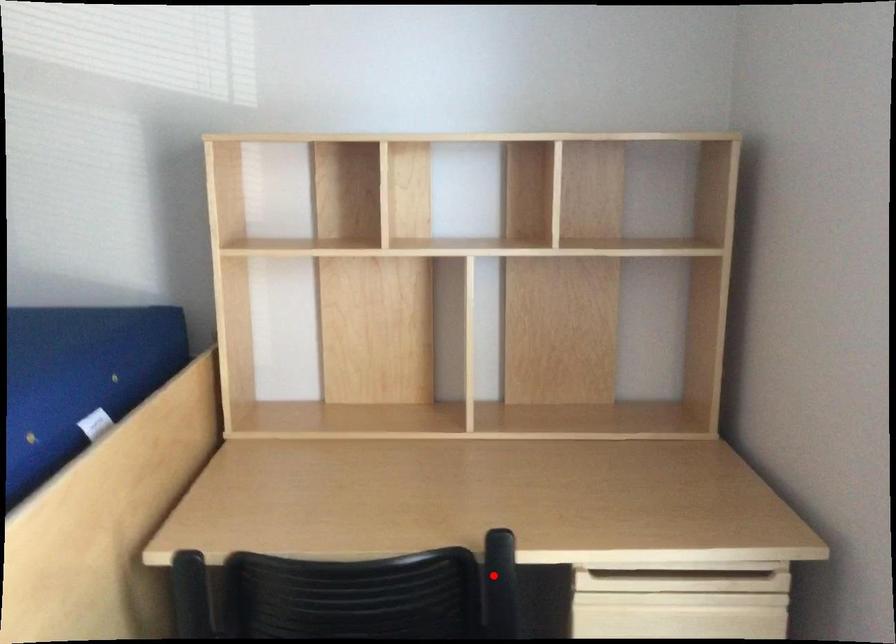
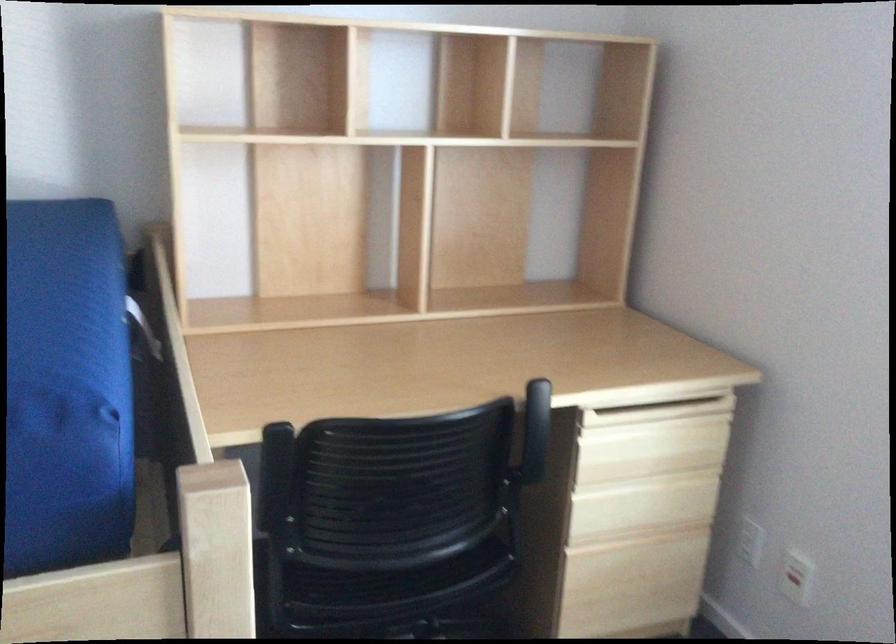
In the second image, find the point that corresponds to the highlighted location in the first image.

(536, 417)